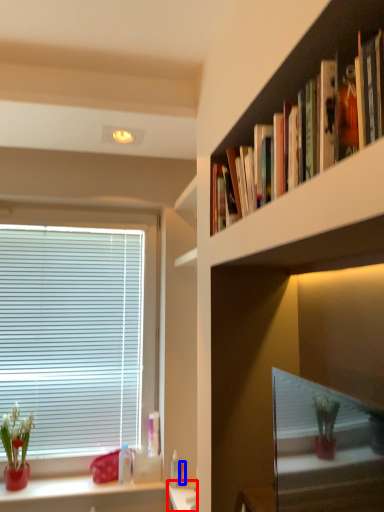
Question: Which object is closer to the camera taking this photo, vanity (highlighted by a red box) or toiletry (highlighted by a blue box)?

Choices:
 (A) vanity
 (B) toiletry

Answer: (A)